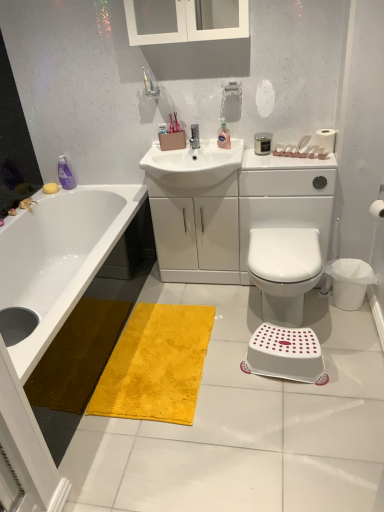
This screenshot has width=384, height=512. What are the coordinates of `free spot in front of white plastic bidet at center` in the screenshot? It's located at (324, 386).